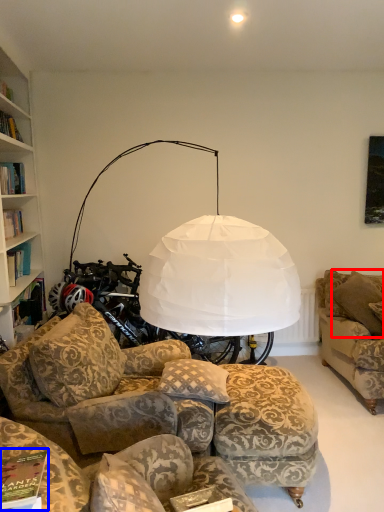
Question: Which point is closer to the camera, pillow (highlighted by a red box) or magazine (highlighted by a blue box)?

Choices:
 (A) pillow
 (B) magazine

Answer: (B)